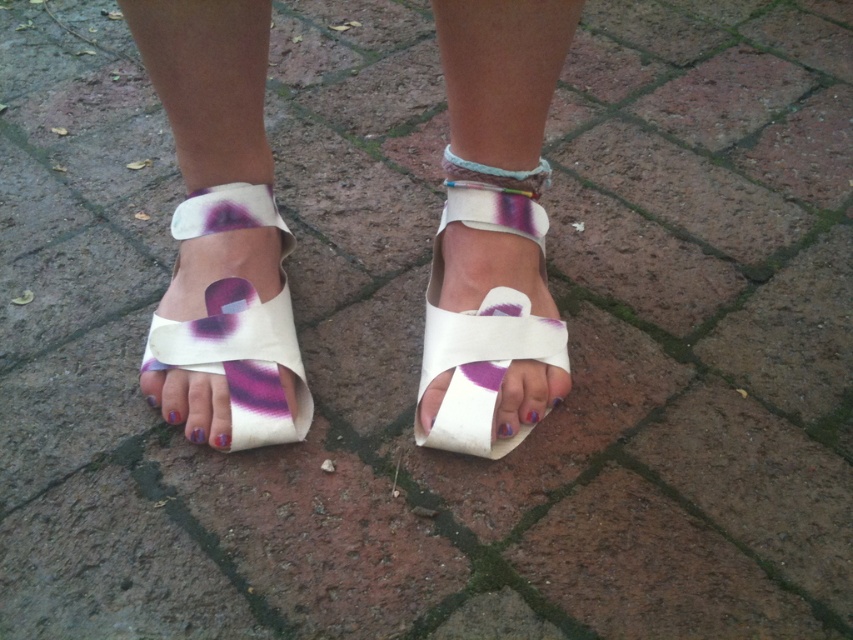
Between point (218, 218) and point (466, 358), which one is positioned behind?

Positioned behind is point (218, 218).

In the scene shown: Does white leather sandal at lower left have a lesser width compared to white matte sandal at center?

Incorrect, white leather sandal at lower left's width is not less than white matte sandal at center's.

Does point (198, 346) come closer to viewer compared to point (512, 307)?

Yes, point (198, 346) is in front of point (512, 307).

In order to click on white leather sandal at lower left in this screenshot , I will do `click(236, 324)`.

Which is below, white leather sandals at center or multicolored woven bracelet at center?

Positioned lower is white leather sandals at center.

Does point (201, 182) come behind point (543, 173)?

Yes.

Does point (548, 348) come behind point (546, 180)?

No, (548, 348) is closer to viewer.

You are a GUI agent. You are given a task and a screenshot of the screen. Output one action in this format:
    pyautogui.click(x=<x>, y=<y>)
    Task: Click on the white leather sandals at center
    The height and width of the screenshot is (640, 853).
    Given the screenshot: What is the action you would take?
    tap(221, 227)

Is white leather sandals at center closer to the viewer compared to white leather sandal at lower left?

Yes, it is in front of white leather sandal at lower left.

Where is `white leather sandals at center`? This screenshot has height=640, width=853. white leather sandals at center is located at coordinates (221, 227).